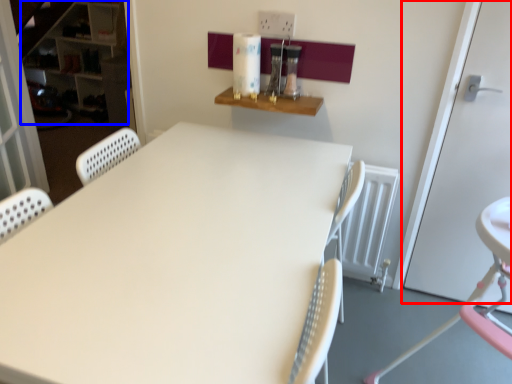
Question: Which object appears closest to the camera in this image, door (highlighted by a red box) or bookshelf (highlighted by a blue box)?

Choices:
 (A) door
 (B) bookshelf

Answer: (A)